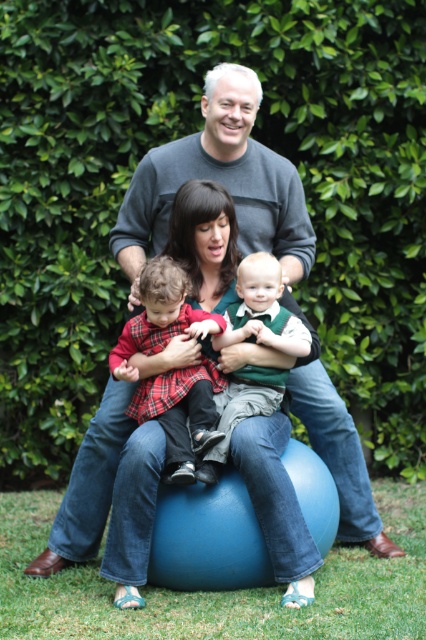
Question: Among these points, which one is nearest to the camera?

Choices:
 (A) (210, 406)
 (B) (253, 374)

Answer: (A)

Question: Which object is closer to the camera taking this photo?

Choices:
 (A) green velvet vest at center
 (B) plaid fabric shirt at center

Answer: (B)

Question: Is plaid fabric shirt at center above green velvet vest at center?

Choices:
 (A) no
 (B) yes

Answer: (B)

Question: Is plaid fabric shirt at center to the left of green velvet vest at center from the viewer's perspective?

Choices:
 (A) no
 (B) yes

Answer: (B)

Question: From the image, what is the correct spatial relationship of plaid fabric shirt at center in relation to green velvet vest at center?

Choices:
 (A) above
 (B) below

Answer: (A)

Question: Which object appears closest to the camera in this image?

Choices:
 (A) plaid fabric shirt at center
 (B) green velvet vest at center

Answer: (A)